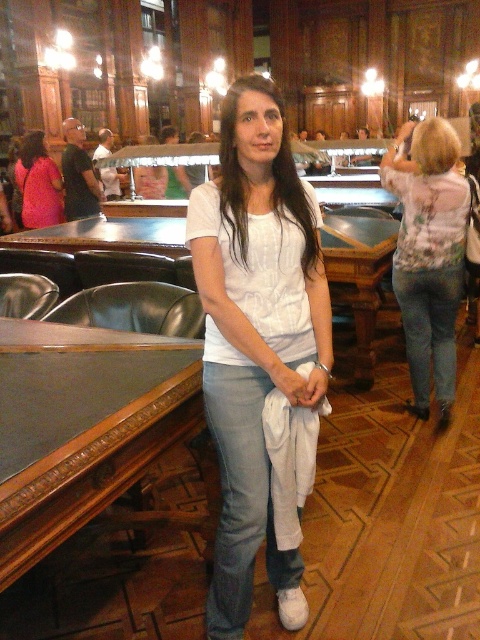
Question: Can you confirm if white cotton t-shirt at center is bigger than matte pink blouse at center?

Choices:
 (A) yes
 (B) no

Answer: (B)

Question: Considering the relative positions of white cotton t-shirt at center and matte pink blouse at center in the image provided, where is white cotton t-shirt at center located with respect to matte pink blouse at center?

Choices:
 (A) below
 (B) above

Answer: (A)

Question: Is white cotton t-shirt at center above floral print blouse at center?

Choices:
 (A) yes
 (B) no

Answer: (B)

Question: Which point appears farthest from the camera in this image?

Choices:
 (A) (468, 204)
 (B) (240, 262)
 (C) (34, 221)

Answer: (C)

Question: Which of the following is the closest to the observer?

Choices:
 (A) (250, 90)
 (B) (444, 339)
 (C) (36, 147)

Answer: (A)

Question: Which point is farther to the camera?

Choices:
 (A) (43, 148)
 (B) (285, 561)
 (C) (410, 173)

Answer: (A)